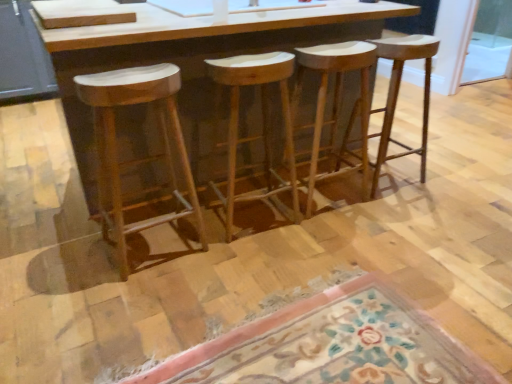
Image resolution: width=512 pixels, height=384 pixels. I want to click on free space on the front side of natural wood stool at center, which appears as the second stool when viewed from the left, so pyautogui.click(x=251, y=259).